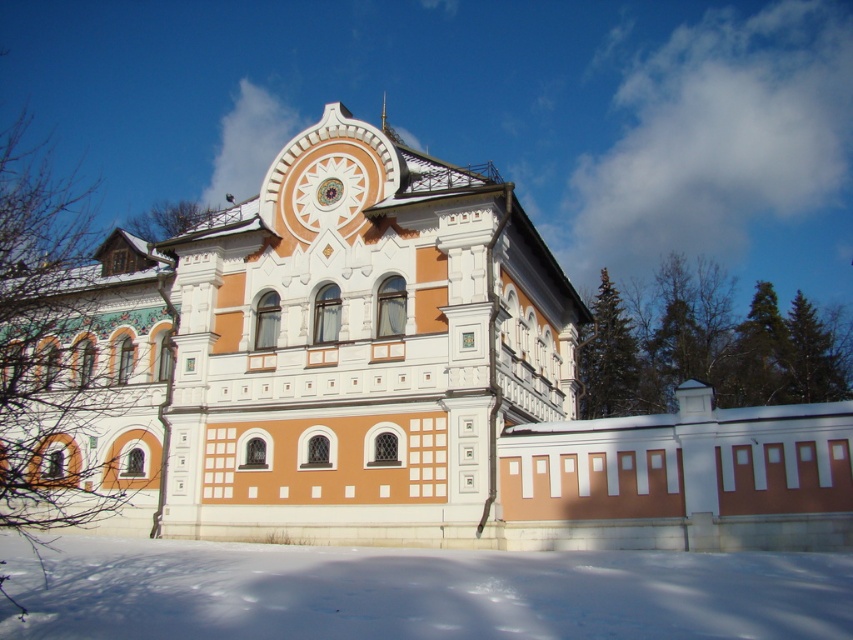
Question: Does orange painted stone palace at center have a smaller size compared to white powdery snow at lower center?

Choices:
 (A) no
 (B) yes

Answer: (A)

Question: Does orange painted stone palace at center have a lesser width compared to white powdery snow at lower center?

Choices:
 (A) no
 (B) yes

Answer: (A)

Question: Which point is closer to the camera?

Choices:
 (A) white powdery snow at lower center
 (B) orange painted stone palace at center

Answer: (A)

Question: Is orange painted stone palace at center thinner than white powdery snow at lower center?

Choices:
 (A) no
 (B) yes

Answer: (A)